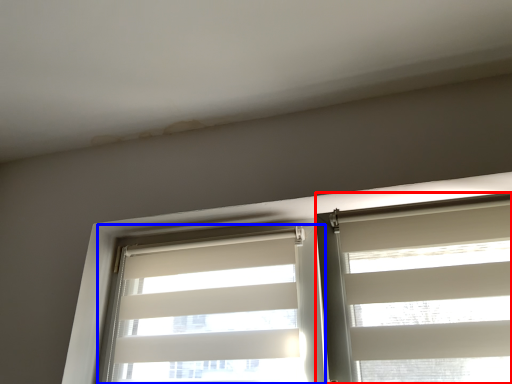
Question: Which of the following is the farthest to the observer, window blind (highlighted by a red box) or window blind (highlighted by a blue box)?

Choices:
 (A) window blind
 (B) window blind

Answer: (B)